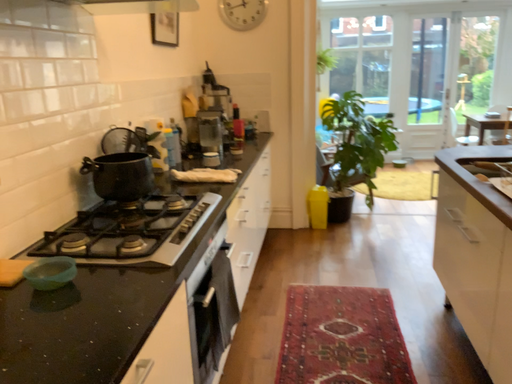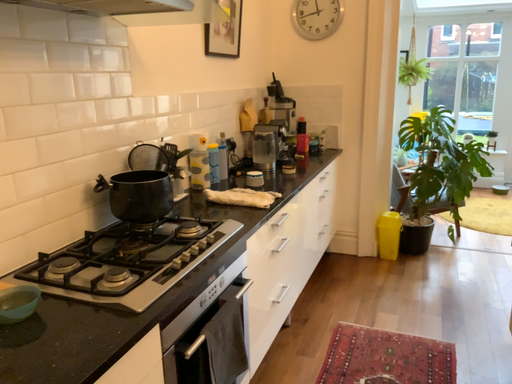
Question: How did the camera likely rotate when shooting the video?

Choices:
 (A) rotated right
 (B) rotated left

Answer: (B)